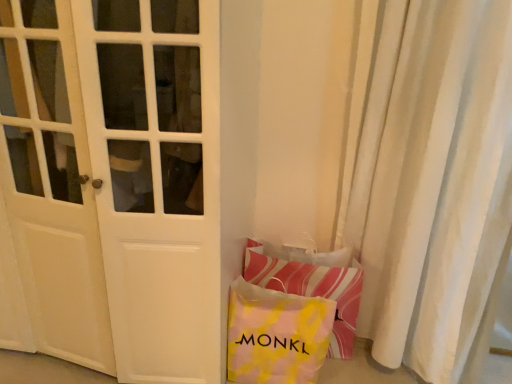
Question: Does striped fabric pillow at lower right have a greater width compared to yellow tie-dye fabric bag at lower right?

Choices:
 (A) no
 (B) yes

Answer: (B)

Question: Considering the relative positions of striped fabric pillow at lower right and yellow tie-dye fabric bag at lower right in the image provided, is striped fabric pillow at lower right behind yellow tie-dye fabric bag at lower right?

Choices:
 (A) yes
 (B) no

Answer: (A)

Question: Is striped fabric pillow at lower right turned away from yellow tie-dye fabric bag at lower right?

Choices:
 (A) no
 (B) yes

Answer: (B)

Question: Can you confirm if striped fabric pillow at lower right is thinner than yellow tie-dye fabric bag at lower right?

Choices:
 (A) no
 (B) yes

Answer: (A)

Question: Would you consider striped fabric pillow at lower right to be distant from yellow tie-dye fabric bag at lower right?

Choices:
 (A) no
 (B) yes

Answer: (A)

Question: Can you confirm if striped fabric pillow at lower right is positioned to the right of yellow tie-dye fabric bag at lower right?

Choices:
 (A) yes
 (B) no

Answer: (A)

Question: From a real-world perspective, is striped fabric pillow at lower right positioned over white matte door at center based on gravity?

Choices:
 (A) no
 (B) yes

Answer: (A)

Question: Is striped fabric pillow at lower right positioned with its back to white matte door at center?

Choices:
 (A) no
 (B) yes

Answer: (A)

Question: Does striped fabric pillow at lower right lie behind white matte door at center?

Choices:
 (A) no
 (B) yes

Answer: (B)

Question: Are striped fabric pillow at lower right and white matte door at center far apart?

Choices:
 (A) yes
 (B) no

Answer: (B)

Question: Considering the relative positions of striped fabric pillow at lower right and white matte door at center in the image provided, is striped fabric pillow at lower right in front of white matte door at center?

Choices:
 (A) yes
 (B) no

Answer: (B)

Question: From the image's perspective, is striped fabric pillow at lower right located beneath white matte door at center?

Choices:
 (A) yes
 (B) no

Answer: (A)

Question: Is white matte door at center in front of white textured curtain at right?

Choices:
 (A) yes
 (B) no

Answer: (A)